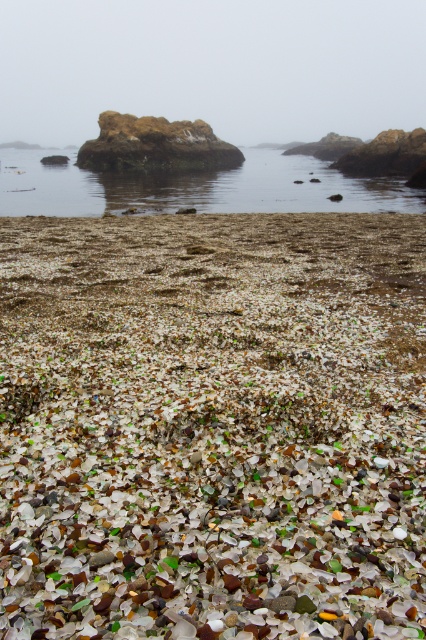
Does clear water at center appear under rusty stone rock at center?

Answer: Correct, clear water at center is located below rusty stone rock at center.

Is clear water at center to the right of rusty stone rock at center from the viewer's perspective?

In fact, clear water at center is to the left of rusty stone rock at center.

Between point (419, 193) and point (91, 147), which one is positioned behind?

The point (91, 147) is behind.

You are a GUI agent. You are given a task and a screenshot of the screen. Output one action in this format:
    pyautogui.click(x=<x>, y=<y>)
    Task: Click on the clear water at center
    The height and width of the screenshot is (640, 426).
    Given the screenshot: What is the action you would take?
    pyautogui.click(x=193, y=186)

Can you confirm if translucent glass pebbles at center is positioned above rusty stone rock at center?

Actually, translucent glass pebbles at center is below rusty stone rock at center.

Describe the element at coordinates (213, 426) in the screenshot. I see `translucent glass pebbles at center` at that location.

What do you see at coordinates (213, 426) in the screenshot? I see `translucent glass pebbles at center` at bounding box center [213, 426].

Identify the location of translucent glass pebbles at center. The width and height of the screenshot is (426, 640). (213, 426).

Can you confirm if translucent glass pebbles at center is bigger than clear water at center?

Actually, translucent glass pebbles at center might be smaller than clear water at center.

Between point (416, 224) and point (45, 179), which one is positioned in front?

Point (416, 224)

Is point (382, 422) in front of point (275, 177)?

That is True.

Identify the location of translucent glass pebbles at center. (213, 426).